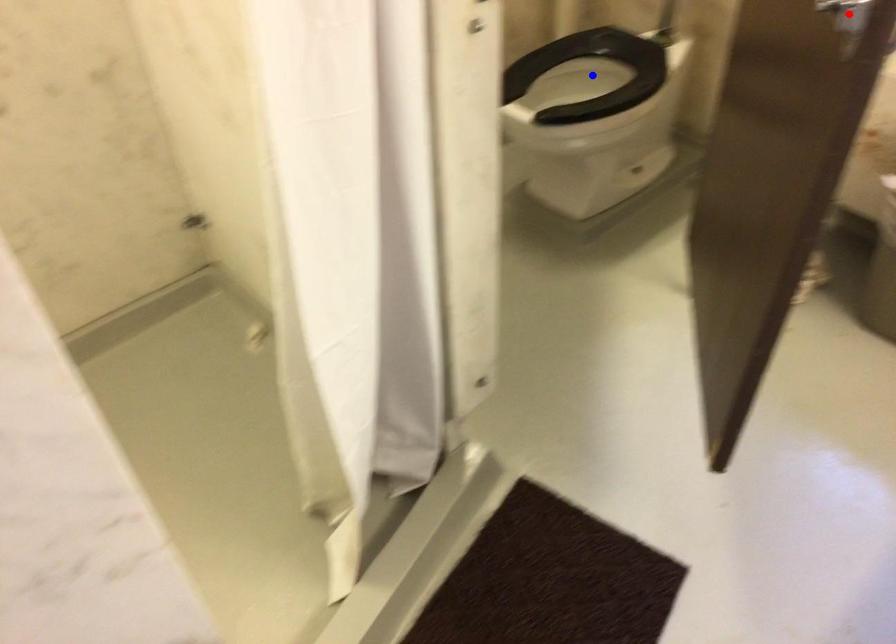
Question: Two points are marked on the image. Which point is closer to the camera?

Choices:
 (A) Blue point is closer.
 (B) Red point is closer.

Answer: (B)